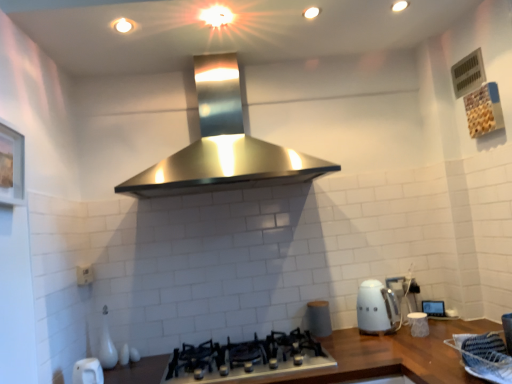
Question: Is satin black gas stove at center bigger or smaller than matte gray canister at center?

Choices:
 (A) big
 (B) small

Answer: (A)

Question: Is satin black gas stove at center in front of or behind matte gray canister at center in the image?

Choices:
 (A) front
 (B) behind

Answer: (A)

Question: Which object is positioned farthest from the white glossy kettle at lower right?

Choices:
 (A) satin black gas stove at center
 (B) matte gray canister at center
 (C) white plastic electric outlet at lower left

Answer: (C)

Question: Which is nearer to the white plastic electric outlet at lower left?

Choices:
 (A) white glossy kettle at lower right
 (B) satin black gas stove at center
 (C) matte gray canister at center

Answer: (B)